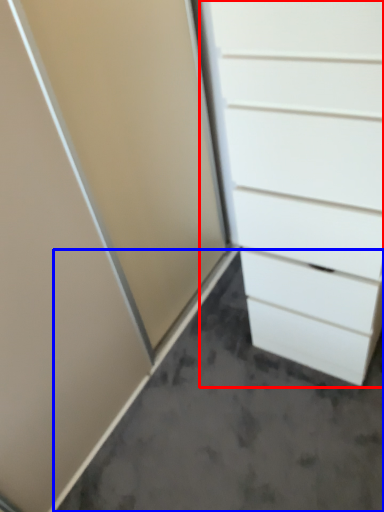
Question: Which point is closer to the camera, chest of drawers (highlighted by a red box) or concrete (highlighted by a blue box)?

Choices:
 (A) chest of drawers
 (B) concrete

Answer: (A)